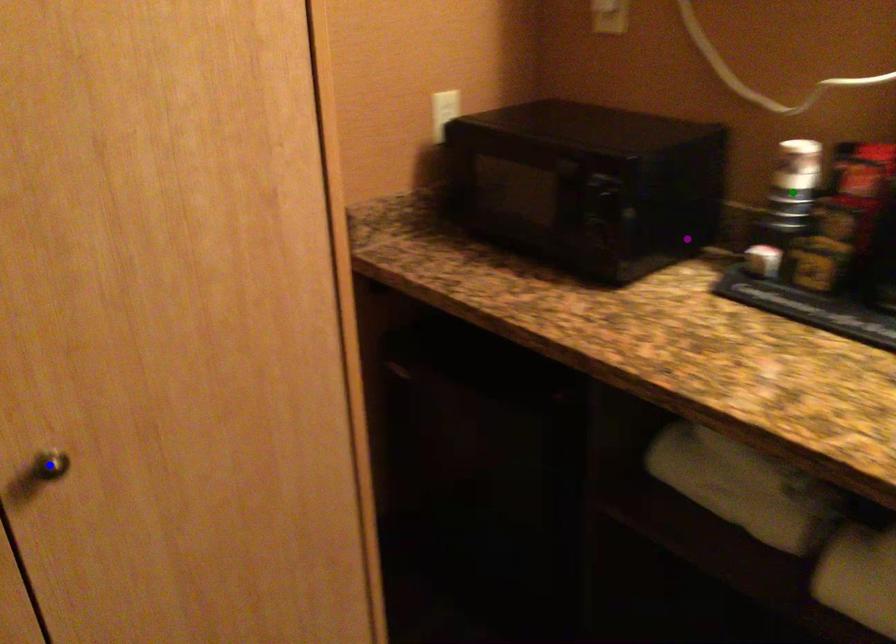
Looking at this image, order these from nearest to farthest:
A) blue point
B) green point
C) purple point

purple point → green point → blue point